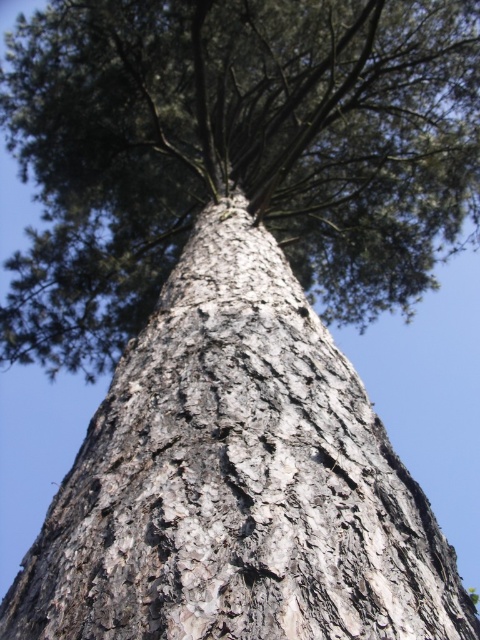
Is smooth bark tree trunk at center to the right of gray textured bark at center from the viewer's perspective?

Incorrect, smooth bark tree trunk at center is not on the right side of gray textured bark at center.

Is smooth bark tree trunk at center taller than gray textured bark at center?

Indeed, smooth bark tree trunk at center has a greater height compared to gray textured bark at center.

Which is behind, point (467, 93) or point (384, 554)?

Point (467, 93)

Locate an element on the screen. This screenshot has width=480, height=640. smooth bark tree trunk at center is located at coordinates (233, 150).